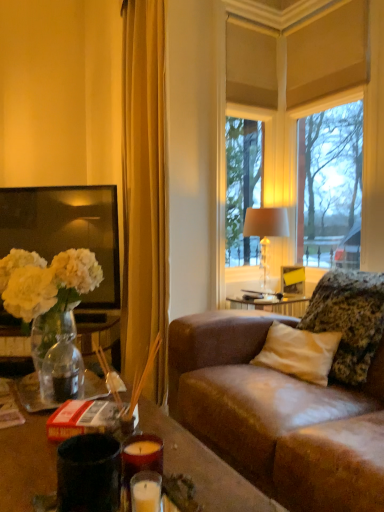
The image size is (384, 512). What do you see at coordinates (303, 105) in the screenshot?
I see `clear glass window at center` at bounding box center [303, 105].

This screenshot has width=384, height=512. Find the location of `fluffy textured pillow at right`. fluffy textured pillow at right is located at coordinates (348, 320).

The height and width of the screenshot is (512, 384). What do you see at coordinates (53, 314) in the screenshot? I see `translucent glass vase at left` at bounding box center [53, 314].

What do you see at coordinates (203, 467) in the screenshot? This screenshot has width=384, height=512. I see `matte red candle at lower center` at bounding box center [203, 467].

Locate an element on the screen. matte red candle at lower center is located at coordinates (203, 467).

Find the location of `clear glass window at center`. clear glass window at center is located at coordinates (303, 105).

Considering the sizes of objects translucent glass vase at left and clear glass window at center in the image provided, who is wider, translucent glass vase at left or clear glass window at center?

translucent glass vase at left is wider.

From a real-world perspective, is translucent glass vase at left located higher than clear glass window at center?

Incorrect, from a real-world perspective, translucent glass vase at left is lower than clear glass window at center.

From the image's perspective, is translucent glass vase at left positioned above or below clear glass window at center?

Clearly, from the image's perspective, translucent glass vase at left is below clear glass window at center.

From a real-world perspective, between translucent glass lamp at center and translucent glass vase at left, who is vertically lower?

translucent glass vase at left.

Which point is more forward, (258,222) or (52,303)?

The point (52,303) is closer to the camera.

Considering the sizes of objects translucent glass lamp at center and translucent glass vase at left in the image provided, who is shorter, translucent glass lamp at center or translucent glass vase at left?

Standing shorter between the two is translucent glass vase at left.

Considering the sizes of objects translucent glass lamp at center and translucent glass vase at left in the image provided, who is bigger, translucent glass lamp at center or translucent glass vase at left?

Bigger between the two is translucent glass vase at left.

Based on the photo, considering the sizes of objects clear glass window at center and translucent glass vase at left in the image provided, who is shorter, clear glass window at center or translucent glass vase at left?

translucent glass vase at left.

From a real-world perspective, which object rests below the other?

translucent glass vase at left.

Is point (221, 37) closer or farther from the camera than point (43, 296)?

Point (221, 37) is farther from the camera than point (43, 296).

In the image, is clear glass window at center positioned in front of or behind translucent glass vase at left?

Clearly, clear glass window at center is behind translucent glass vase at left.

From a real-world perspective, who is located higher, clear glass window at center or matte red candle at lower center?

clear glass window at center is physically above.

From the image's perspective, who appears lower, clear glass window at center or matte red candle at lower center?

matte red candle at lower center is shown below in the image.

This screenshot has height=512, width=384. Find the location of `desk lying on the left of clear glass window at center`. desk lying on the left of clear glass window at center is located at coordinates (203, 467).

Would you consider clear glass window at center to be distant from matte red candle at lower center?

clear glass window at center is far away from matte red candle at lower center.

From the image's perspective, is clear glass window at center below fluffy textured pillow at right?

No.

Which object is thinner, clear glass window at center or fluffy textured pillow at right?

Thinner between the two is clear glass window at center.

How many degrees apart are the facing directions of clear glass window at center and fluffy textured pillow at right?

The angle between the facing direction of clear glass window at center and the facing direction of fluffy textured pillow at right is 0.307 degrees.

Can you tell me how much matte red candle at lower center and translucent glass lamp at center differ in facing direction?

1.2 degrees.

Could you tell me if matte red candle at lower center is facing translucent glass lamp at center?

No, matte red candle at lower center is not facing towards translucent glass lamp at center.

Between matte red candle at lower center and translucent glass lamp at center, which one has larger size?

translucent glass lamp at center is bigger.

Considering the positions of point (356, 381) and point (254, 221), is point (356, 381) closer or farther from the camera than point (254, 221)?

Point (356, 381) is positioned closer to the camera compared to point (254, 221).

From a real-world perspective, is fluffy textured pillow at right above or below translucent glass lamp at center?

Clearly, from a real-world perspective, fluffy textured pillow at right is below translucent glass lamp at center.

Image resolution: width=384 pixels, height=512 pixels. I want to click on lamp on the left side of fluffy textured pillow at right, so click(x=266, y=227).

Looking at this image, does fluffy textured pillow at right have a lesser height compared to translucent glass lamp at center?

Indeed, fluffy textured pillow at right has a lesser height compared to translucent glass lamp at center.

You are a GUI agent. You are given a task and a screenshot of the screen. Output one action in this format:
    pyautogui.click(x=<x>, y=<y>)
    Task: Click on the window located on the right of translucent glass vase at left
    
    Given the screenshot: What is the action you would take?
    pyautogui.click(x=303, y=105)

Locate an element on the screen. This screenshot has height=512, width=384. houseplant located in front of the translucent glass lamp at center is located at coordinates (53, 314).

From the image, which object appears to be nearer to fluffy textured pillow at right, translucent glass lamp at center or clear glass window at center?

translucent glass lamp at center is positioned closer to the anchor fluffy textured pillow at right.

Considering their positions, is translucent glass vase at left positioned further to translucent glass lamp at center than clear glass window at center?

translucent glass vase at left is further to translucent glass lamp at center.

Estimate the real-world distances between objects in this image. Which object is further from translucent glass vase at left, clear glass window at center or fluffy textured pillow at right?

The object further to translucent glass vase at left is clear glass window at center.

Looking at this image, when comparing their distances from translucent glass vase at left, does translucent glass lamp at center or matte red candle at lower center seem closer?

Among the two, matte red candle at lower center is located nearer to translucent glass vase at left.

Which object lies nearer to the anchor point matte red candle at lower center, clear glass window at center or translucent glass lamp at center?

translucent glass lamp at center is positioned closer to the anchor matte red candle at lower center.

Based on their spatial positions, is fluffy textured pillow at right or matte red candle at lower center closer to translucent glass vase at left?

The object closer to translucent glass vase at left is matte red candle at lower center.

When comparing their distances from clear glass window at center, does matte red candle at lower center or translucent glass vase at left seem further?

The object further to clear glass window at center is matte red candle at lower center.

From the image, which object appears to be nearer to translucent glass lamp at center, fluffy textured pillow at right or matte red candle at lower center?

Among the two, fluffy textured pillow at right is located nearer to translucent glass lamp at center.

Locate an element on the screen. This screenshot has height=512, width=384. pillow located between matte red candle at lower center and translucent glass lamp at center in the depth direction is located at coordinates (348, 320).

Find the location of `desk between translucent glass vase at left and fluffy textured pillow at right from left to right`. desk between translucent glass vase at left and fluffy textured pillow at right from left to right is located at coordinates (203, 467).

Where is `window between matte red candle at lower center and translucent glass lamp at center from front to back`? This screenshot has height=512, width=384. window between matte red candle at lower center and translucent glass lamp at center from front to back is located at coordinates (303, 105).

Locate an element on the screen. pillow positioned between translucent glass vase at left and translucent glass lamp at center from near to far is located at coordinates (348, 320).